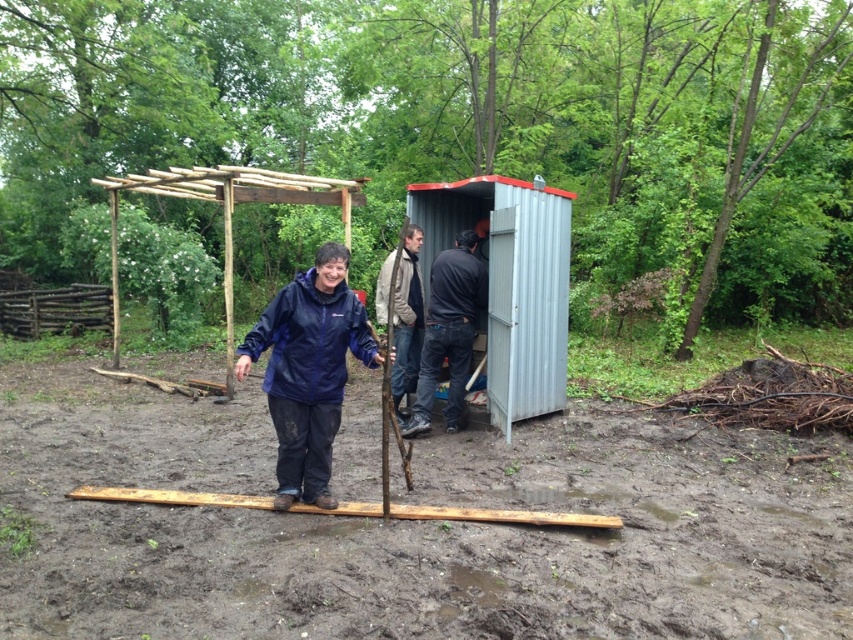
Is point (165, 586) positioned in front of point (422, 420)?

That is True.

Find the location of `brown muddy dirt at center`. brown muddy dirt at center is located at coordinates (412, 528).

Can you confirm if navy blue jacket at center is thinner than light brown leather jacket at center?

In fact, navy blue jacket at center might be wider than light brown leather jacket at center.

This screenshot has width=853, height=640. What do you see at coordinates (308, 371) in the screenshot?
I see `navy blue jacket at center` at bounding box center [308, 371].

Who is more distant from viewer, (321, 385) or (415, 346)?

The point (415, 346) is behind.

Where is `navy blue jacket at center`? navy blue jacket at center is located at coordinates (308, 371).

Image resolution: width=853 pixels, height=640 pixels. Describe the element at coordinates (509, 282) in the screenshot. I see `metallic gray shed at center` at that location.

In order to click on metallic gray shed at center in this screenshot , I will do `click(509, 282)`.